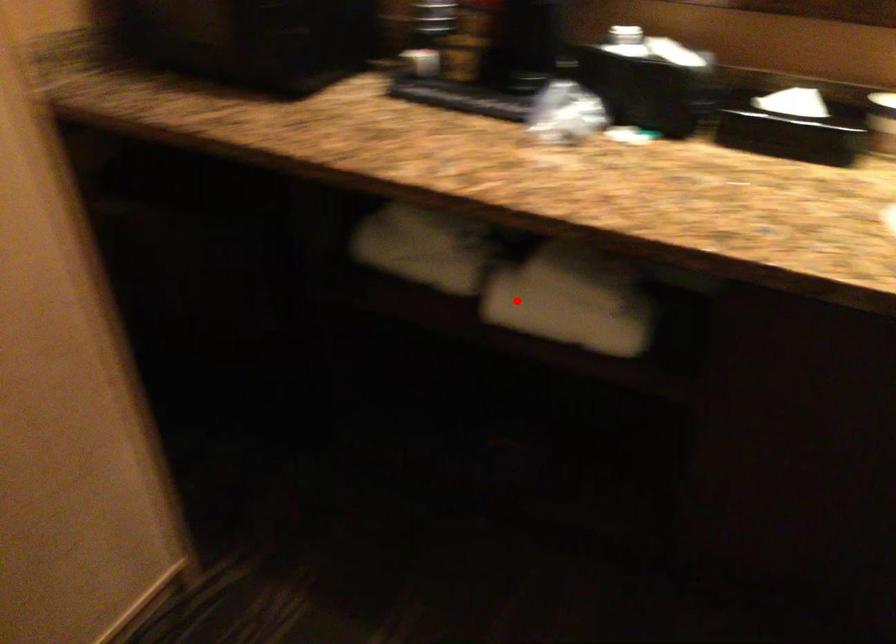
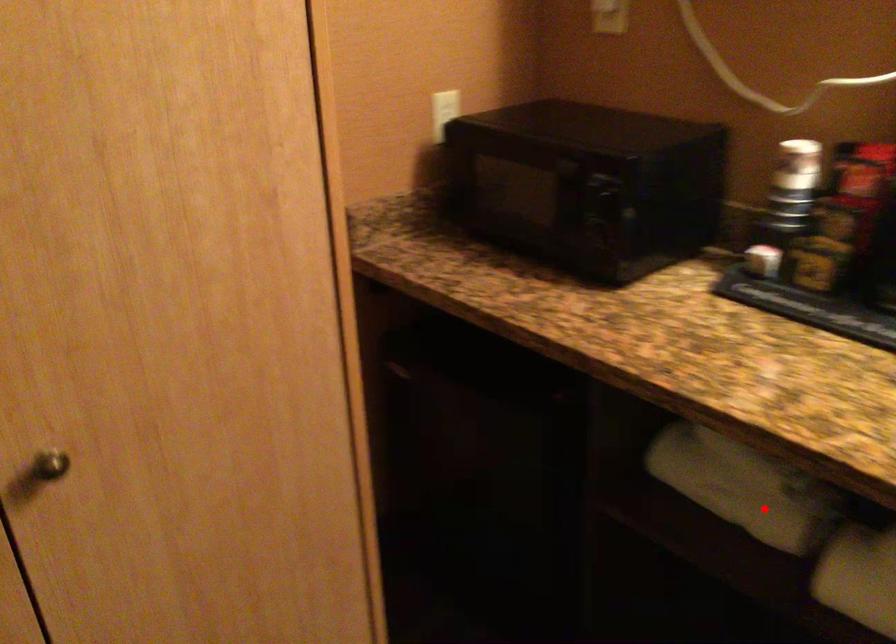
I am providing you with two images of the same scene from different viewpoints. A red point is marked on the first image and another point is marked on the second image. Does the point marked in image1 correspond to the same location as the one in image2?

No